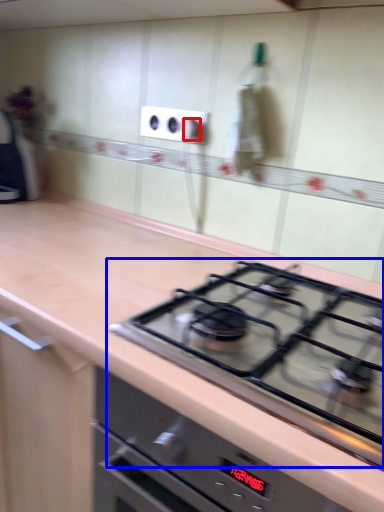
Question: Which of the following is the closest to the observer, knob (highlighted by a red box) or gas stove (highlighted by a blue box)?

Choices:
 (A) knob
 (B) gas stove

Answer: (B)